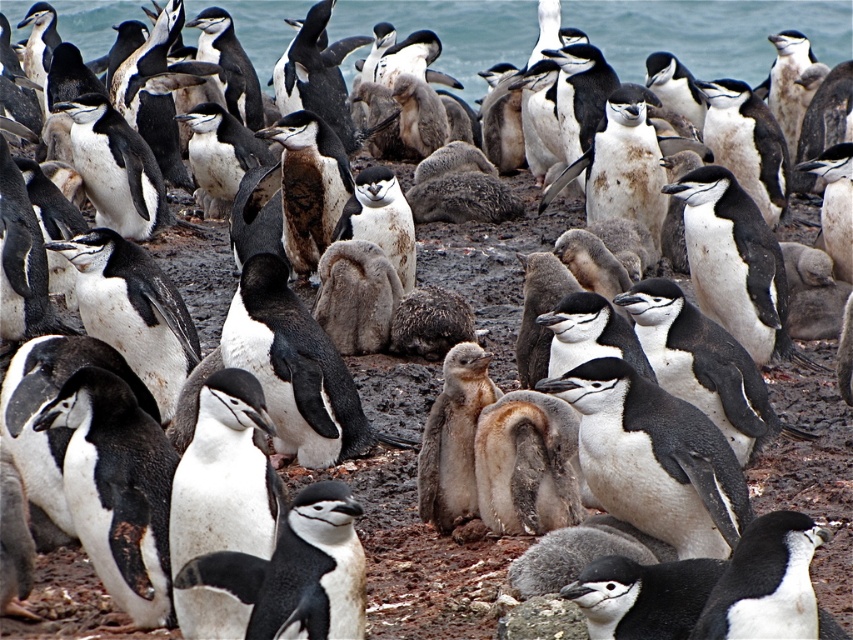
You are a penguin parent looking for your chick. You see the blue water at upper center and the white matte penguin at center. Which one is bigger in size?

The blue water at upper center is larger in size than the white matte penguin at center.

You are a penguin parent looking for your chick. You see a white matte penguin at center and blue water at upper center. Which direction should you look to find your chick if the chick is closer to the water?

The blue water at upper center is positioned on the right side of white matte penguin at center. Therefore, the chick is likely to the right of the white matte penguin at center near the blue water at upper center.

You are a penguin researcher observing the group from a distance. You notice a point marked at coordinate [708,33]. Based on the scene description, what is located at this point?

The point at coordinate [708,33] corresponds to blue water at upper center.